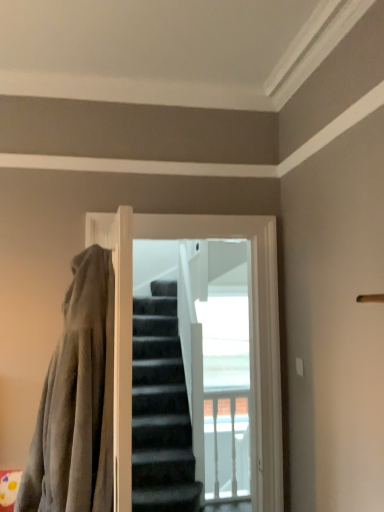
Locate an element on the screen. The image size is (384, 512). velvety gray blanket at left is located at coordinates (77, 400).

The width and height of the screenshot is (384, 512). What do you see at coordinates (77, 400) in the screenshot?
I see `velvety gray blanket at left` at bounding box center [77, 400].

Find the location of a particular element. This screenshot has width=384, height=512. dark gray carpeted stairs at center is located at coordinates (191, 377).

What do you see at coordinates (191, 377) in the screenshot? Image resolution: width=384 pixels, height=512 pixels. I see `dark gray carpeted stairs at center` at bounding box center [191, 377].

The width and height of the screenshot is (384, 512). In order to click on velvety gray blanket at left in this screenshot , I will do `click(77, 400)`.

Can you confirm if dark gray carpeted stairs at center is positioned to the left of velvety gray blanket at left?

Incorrect, dark gray carpeted stairs at center is not on the left side of velvety gray blanket at left.

Is the depth of dark gray carpeted stairs at center greater than that of velvety gray blanket at left?

That is True.

Does point (133, 448) appear closer or farther from the camera than point (100, 484)?

Point (133, 448) is positioned farther from the camera compared to point (100, 484).

From the image's perspective, which object appears higher, dark gray carpeted stairs at center or velvety gray blanket at left?

velvety gray blanket at left appears higher in the image.

From a real-world perspective, which object stands above the other?

dark gray carpeted stairs at center, from a real-world perspective.

Does dark gray carpeted stairs at center have a greater width compared to velvety gray blanket at left?

No, dark gray carpeted stairs at center is not wider than velvety gray blanket at left.

Between dark gray carpeted stairs at center and velvety gray blanket at left, which one has more height?

dark gray carpeted stairs at center.

Is dark gray carpeted stairs at center bigger than velvety gray blanket at left?

Incorrect, dark gray carpeted stairs at center is not larger than velvety gray blanket at left.

Can velvety gray blanket at left be found inside dark gray carpeted stairs at center?

No, velvety gray blanket at left is not inside dark gray carpeted stairs at center.

Is dark gray carpeted stairs at center placed right next to velvety gray blanket at left?

No, dark gray carpeted stairs at center is not touching velvety gray blanket at left.

Is dark gray carpeted stairs at center facing away from velvety gray blanket at left?

No, dark gray carpeted stairs at center's orientation is not away from velvety gray blanket at left.

There is a velvety gray blanket at left. Where is `screen door above it (from a real-world perspective)`? The image size is (384, 512). screen door above it (from a real-world perspective) is located at coordinates (191, 377).

Between velvety gray blanket at left and dark gray carpeted stairs at center, which one appears on the left side from the viewer's perspective?

Positioned to the left is velvety gray blanket at left.

Is velvety gray blanket at left further to the viewer compared to dark gray carpeted stairs at center?

No, velvety gray blanket at left is in front of dark gray carpeted stairs at center.

Considering the points (83, 426) and (153, 357), which point is behind, point (83, 426) or point (153, 357)?

Positioned behind is point (153, 357).

From the image's perspective, is velvety gray blanket at left beneath dark gray carpeted stairs at center?

Actually, velvety gray blanket at left appears above dark gray carpeted stairs at center in the image.

In the scene shown: From a real-world perspective, which object stands above the other?

dark gray carpeted stairs at center.

Which object is wider, velvety gray blanket at left or dark gray carpeted stairs at center?

velvety gray blanket at left is wider.

Who is taller, velvety gray blanket at left or dark gray carpeted stairs at center?

dark gray carpeted stairs at center.

Can you confirm if velvety gray blanket at left is smaller than dark gray carpeted stairs at center?

Incorrect, velvety gray blanket at left is not smaller in size than dark gray carpeted stairs at center.

Which is correct: velvety gray blanket at left is inside dark gray carpeted stairs at center, or outside of it?

velvety gray blanket at left is not inside dark gray carpeted stairs at center, it's outside.

Is the surface of velvety gray blanket at left in direct contact with dark gray carpeted stairs at center?

No, velvety gray blanket at left is not beside dark gray carpeted stairs at center.

Is velvety gray blanket at left turned away from dark gray carpeted stairs at center?

Yes, velvety gray blanket at left is facing away from dark gray carpeted stairs at center.

Locate an element on the screen. The height and width of the screenshot is (512, 384). screen door behind the velvety gray blanket at left is located at coordinates (x=191, y=377).

This screenshot has height=512, width=384. I want to click on blanket on the left side of dark gray carpeted stairs at center, so click(77, 400).

Where is `screen door on the right of velvety gray blanket at left`? screen door on the right of velvety gray blanket at left is located at coordinates tap(191, 377).